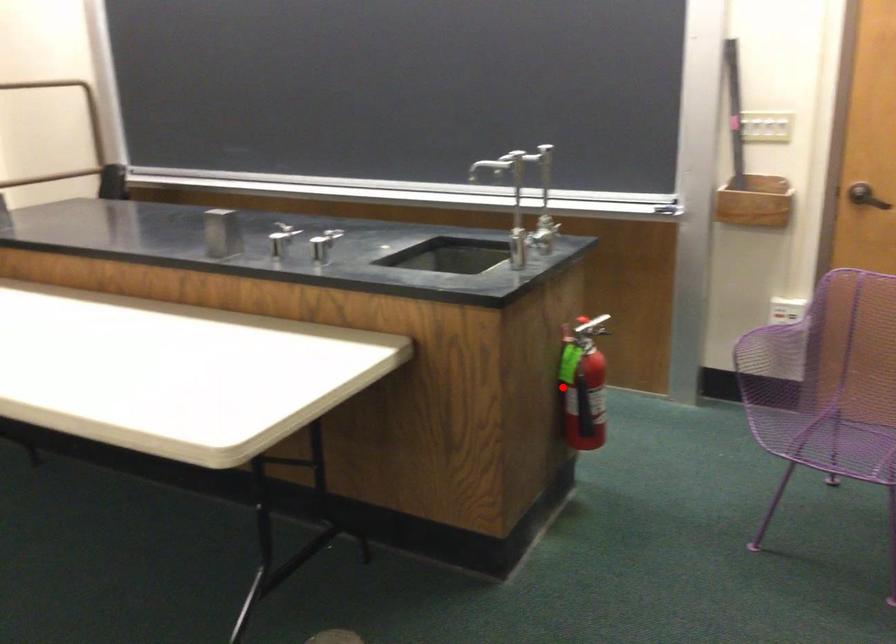
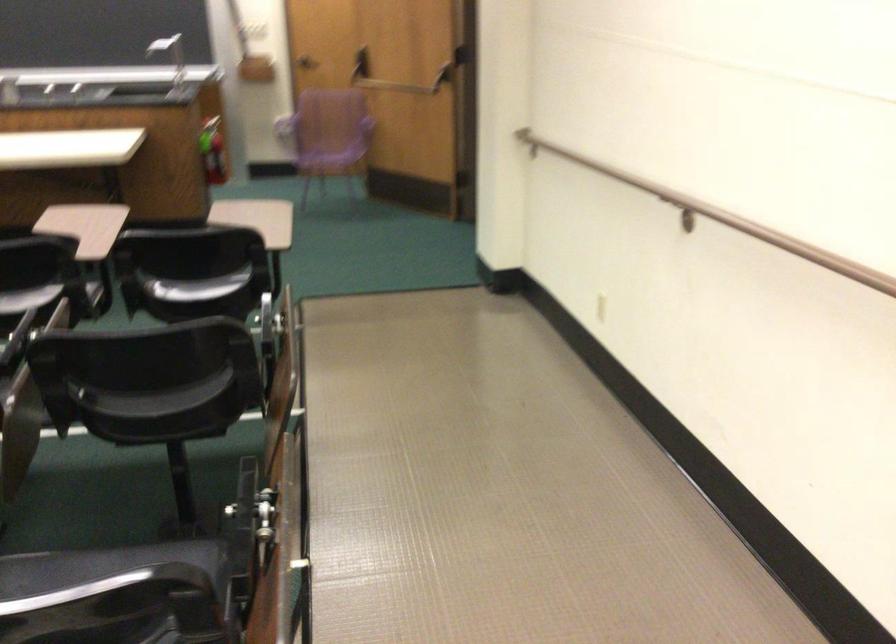
Question: I am providing you with two images of the same scene from different viewpoints. A red point is marked on the first image. Is the red point's position out of view in image 2?

Choices:
 (A) Yes
 (B) No

Answer: (B)